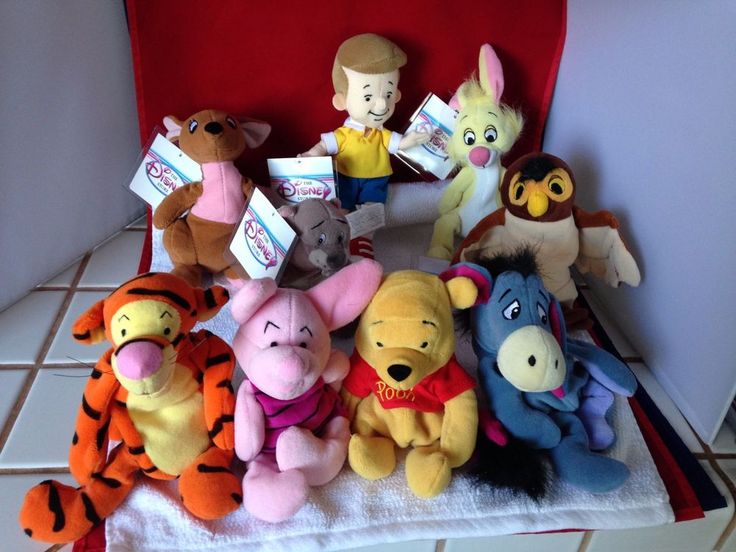
The height and width of the screenshot is (552, 736). Find the location of `stuffed toys on front row`. stuffed toys on front row is located at coordinates (171, 400), (291, 368), (421, 359), (528, 375).